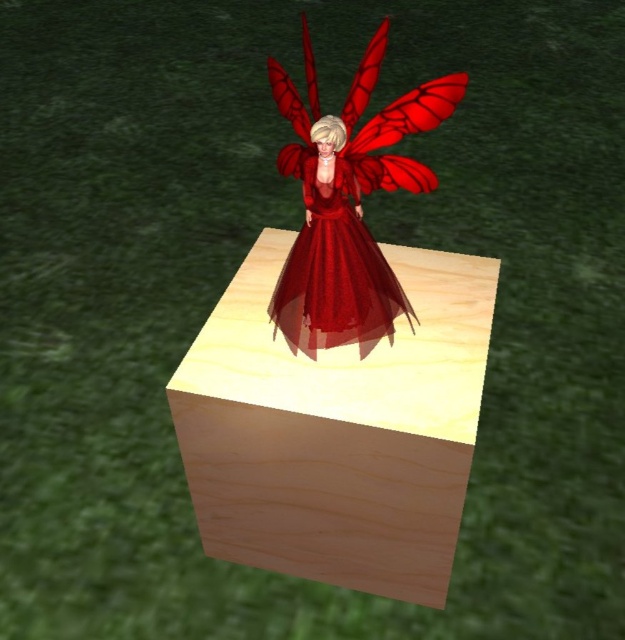
Question: Can you confirm if wooden cube at center is positioned to the left of shiny red dress at center?

Choices:
 (A) no
 (B) yes

Answer: (B)

Question: Is wooden cube at center wider than shiny red dress at center?

Choices:
 (A) yes
 (B) no

Answer: (A)

Question: Can you confirm if wooden cube at center is positioned below shiny red dress at center?

Choices:
 (A) no
 (B) yes

Answer: (B)